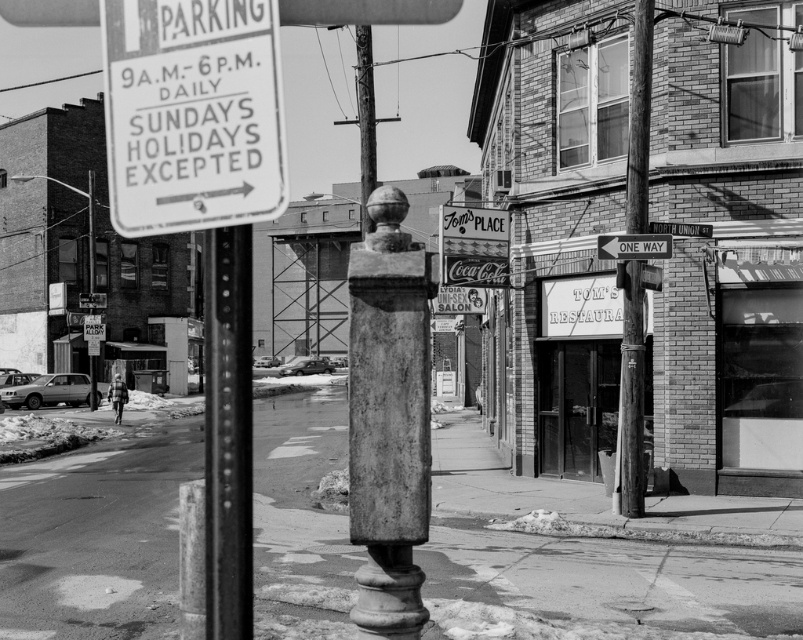
Question: Estimate the real-world distances between objects in this image. Which object is closer to the white paper sign at upper left?

Choices:
 (A) wooden pole at center-right
 (B) metallic one way sign at center

Answer: (B)

Question: Can you confirm if wooden pole at center-right is positioned to the right of metallic one way sign at center?

Choices:
 (A) yes
 (B) no

Answer: (A)

Question: Does white paper sign at upper left have a lesser width compared to white paper street sign at upper center?

Choices:
 (A) no
 (B) yes

Answer: (A)

Question: Can you confirm if wooden pole at center-right is bigger than metallic one way sign at center?

Choices:
 (A) no
 (B) yes

Answer: (B)

Question: Which point is farther to the camera?

Choices:
 (A) (630, 252)
 (B) (634, 161)
 (C) (111, 179)

Answer: (B)

Question: Which object is positioned closest to the white paper street sign at upper center?

Choices:
 (A) white paper sign at upper left
 (B) wooden pole at center-right

Answer: (B)